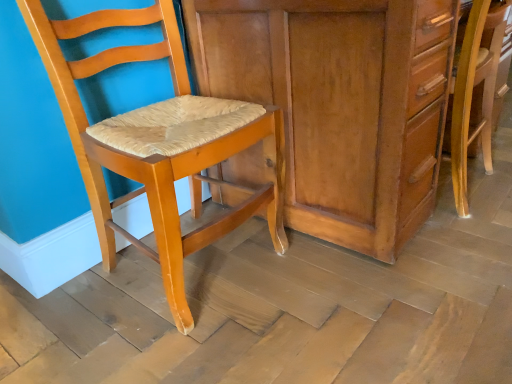
Question: From the image's perspective, is matte wood chair at left, positioned as the second chair in right-to-left order, above or below matte wood cabinet at center?

Choices:
 (A) below
 (B) above

Answer: (A)

Question: Is point (105, 167) closer or farther from the camera than point (357, 89)?

Choices:
 (A) farther
 (B) closer

Answer: (B)

Question: Which is nearer to the wooden chair at right, the first chair in the right-to-left sequence?

Choices:
 (A) matte wood chair at left, the 1th chair when ordered from left to right
 (B) matte wood cabinet at center

Answer: (B)

Question: Estimate the real-world distances between objects in this image. Which object is farther from the matte wood chair at left, the 1th chair when ordered from left to right?

Choices:
 (A) matte wood cabinet at center
 (B) wooden chair at right, acting as the 2th chair starting from the left

Answer: (B)